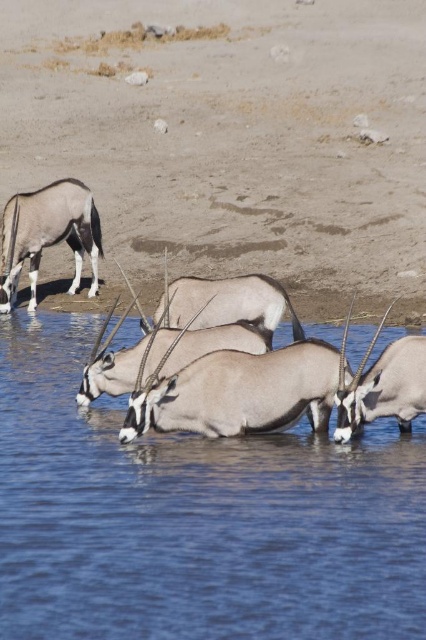
Question: Does blue clear water at center have a lesser width compared to brown glossy antelope at center?

Choices:
 (A) no
 (B) yes

Answer: (B)

Question: Which object appears closest to the camera in this image?

Choices:
 (A) smooth brown antelope at center
 (B) brown glossy antelope at lower center

Answer: (B)

Question: Among these points, which one is nearest to the camera?

Choices:
 (A) (414, 369)
 (B) (155, 490)

Answer: (B)

Question: Which point is farther from the camera taking this photo?

Choices:
 (A) (216, 531)
 (B) (48, 227)
 (C) (403, 428)

Answer: (B)

Question: Can you confirm if blue clear water at center is positioned to the right of smooth brown antelope at center?

Choices:
 (A) yes
 (B) no

Answer: (B)

Question: Observing the image, what is the correct spatial positioning of shiny brown antelope at upper left in reference to brown glossy antelope at center?

Choices:
 (A) right
 (B) left

Answer: (B)